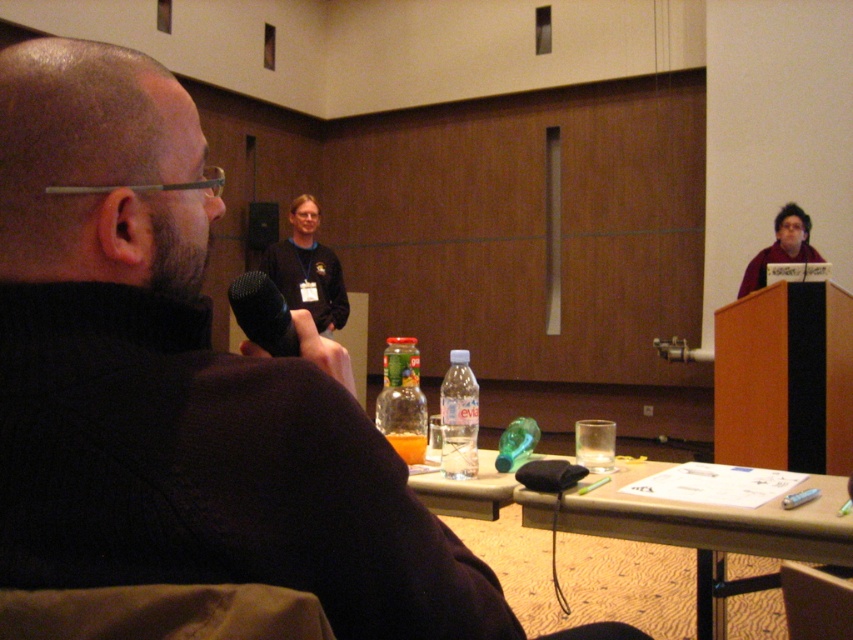
You are organizing a presentation and need to place a water bottle and a microphone on a table. The clear plastic bottle at center and black matte microphone at center must be placed such that they are exactly 30 inches apart. Given that the table is 36 inches wide, can both items fit on the table without overlapping?

The clear plastic bottle at center and black matte microphone at center are 29.94 inches apart, which is just under 30 inches. Since the table is 36 inches wide, there is enough space to place both items without overlapping. The total required space would be approximately 30 inches, leaving about 6 inches of extra space on the table.

You are organizing a presentation and need to place a name tag on the table where the clear plastic bottle at center and the black matte microphone at center are located. If the name tag requires 10 cm of space, will there be enough room between these two items?

The clear plastic bottle at center is larger in size than the black matte microphone at center, but the exact distance between them isn not provided. Therefore, it is unclear if there is sufficient space for the name tag requiring 10 cm.

You are attending a presentation in the conference room and notice two bottles on the table. Which bottle, the translucent glass bottle at center or the clear plastic bottle at center, is positioned closer to you?

The translucent glass bottle at center is closer to the viewer than the clear plastic bottle at center.